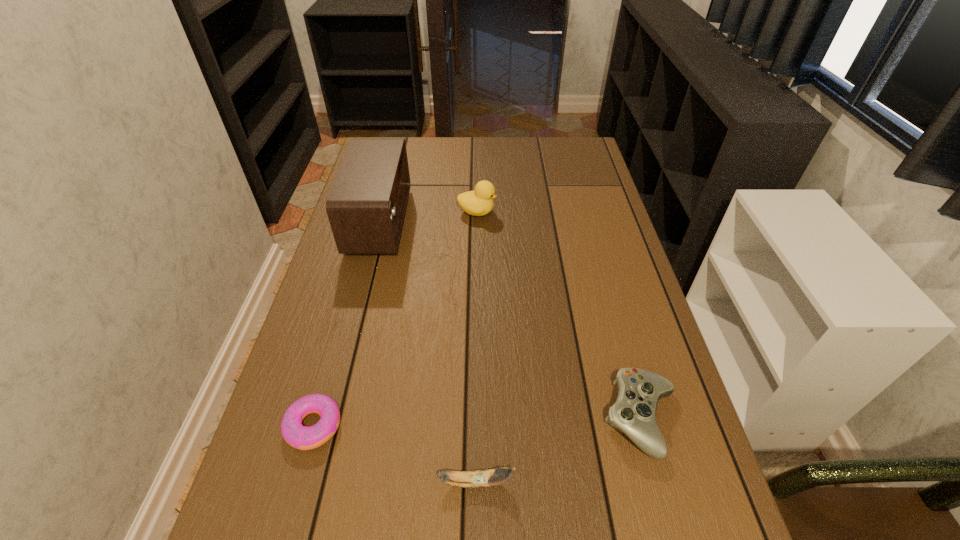
Locate an element on the screen. This screenshot has width=960, height=540. the tallest object is located at coordinates (366, 206).

Find the location of a particular element. Image resolution: width=960 pixels, height=540 pixels. duck is located at coordinates (479, 202).

Where is `banana`? banana is located at coordinates (480, 478).

This screenshot has height=540, width=960. I want to click on the rightmost object, so click(634, 413).

What are the coordinates of `the shortest object` in the screenshot? It's located at (301, 437).

Where is `vacant space situated on the front-facing side of the tallest object`? vacant space situated on the front-facing side of the tallest object is located at coordinates (428, 222).

The height and width of the screenshot is (540, 960). In order to click on blank space located 0.190m on the front-facing side of the duck in this screenshot , I will do `click(558, 212)`.

In order to click on blank area located 0.240m on the peel of the nearest object in this screenshot , I will do `click(646, 482)`.

Where is `vacant position located on the front of the rightmost object`? This screenshot has height=540, width=960. vacant position located on the front of the rightmost object is located at coordinates (666, 509).

Locate an element on the screen. This screenshot has width=960, height=540. free space located 0.080m on the right of the doughnut is located at coordinates (382, 426).